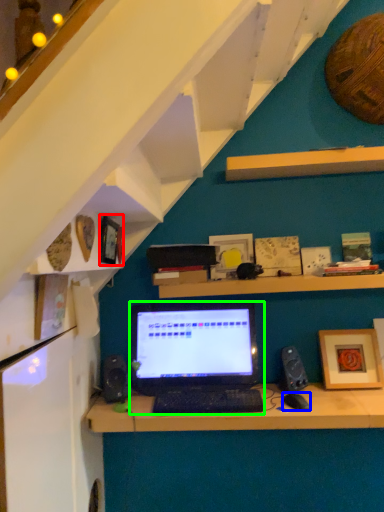
Question: Considering the real-world distances, which object is closest to picture frame (highlighted by a red box)? computer mouse (highlighted by a blue box) or laptop (highlighted by a green box).

Choices:
 (A) computer mouse
 (B) laptop

Answer: (B)